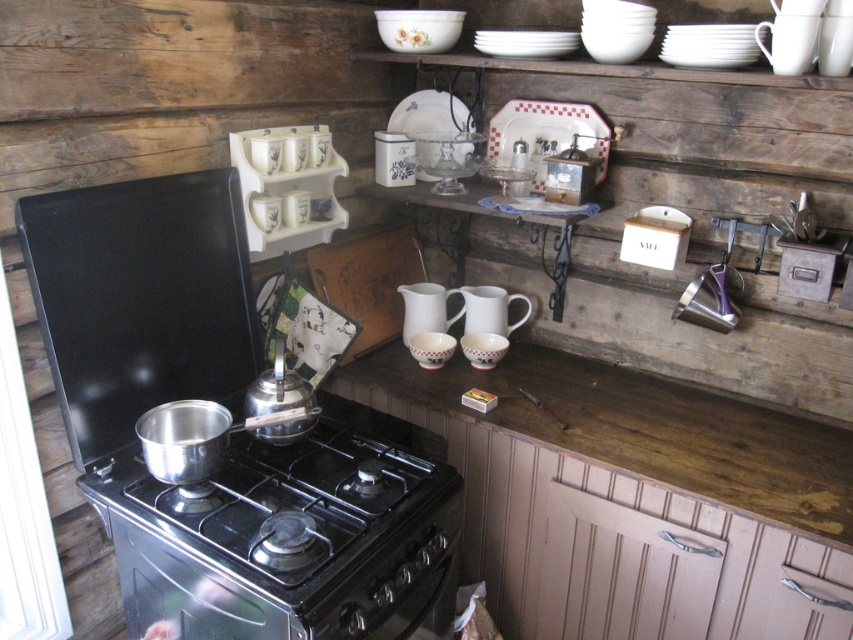
Question: Can you confirm if white ceramic mugs at upper center is positioned to the left of white glossy plate at upper center?

Choices:
 (A) yes
 (B) no

Answer: (A)

Question: Can you confirm if white ceramic mugs at upper center is positioned below white porcelain pitcher at center?

Choices:
 (A) no
 (B) yes

Answer: (A)

Question: Which object is closer to the camera taking this photo?

Choices:
 (A) black matte exhaust hood at upper left
 (B) white porcelain pitcher at center
 (C) brushed metal teapot at stove top
 (D) white matte pitcher at center

Answer: (A)

Question: Can you confirm if black matte exhaust hood at upper left is positioned to the left of white ceramic mugs at upper center?

Choices:
 (A) yes
 (B) no

Answer: (A)

Question: Which of the following is the farthest from the observer?

Choices:
 (A) (82, 349)
 (B) (279, 342)
 (C) (476, 320)

Answer: (C)

Question: Which is farther from the white ceramic mugs at upper center?

Choices:
 (A) black matte exhaust hood at upper left
 (B) white matte pitcher at center
 (C) brushed metal teapot at stove top
 (D) white glossy plate at upper center

Answer: (D)